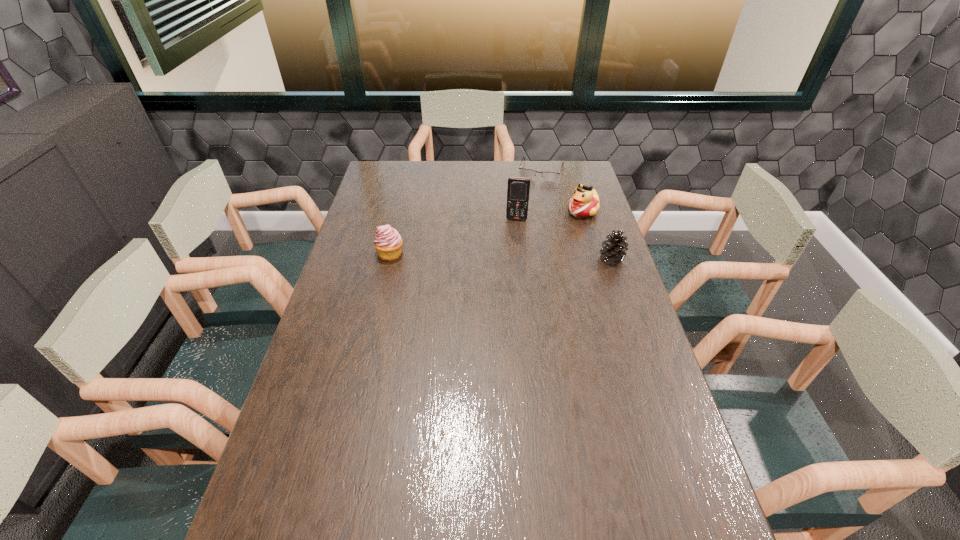
Locate an element on the screen. This screenshot has width=960, height=540. duck positioned at the right edge is located at coordinates (585, 202).

Identify the location of spectacles located in the right edge section of the desktop. (526, 173).

Locate an element on the screen. The height and width of the screenshot is (540, 960). object present at the far right corner is located at coordinates (526, 173).

Locate an element on the screen. vacant area at the far edge is located at coordinates (495, 170).

This screenshot has width=960, height=540. Identify the location of vacant area at the near edge of the desktop. (588, 490).

Where is `vacant space at the right edge of the desktop`? This screenshot has height=540, width=960. vacant space at the right edge of the desktop is located at coordinates (595, 281).

The image size is (960, 540). I want to click on vacant space at the far left corner of the desktop, so click(390, 168).

In the image, there is a desktop. Where is `vacant space at the far right corner`? The image size is (960, 540). vacant space at the far right corner is located at coordinates (567, 162).

The width and height of the screenshot is (960, 540). Find the location of `free spot between the duck and the spectacles`. free spot between the duck and the spectacles is located at coordinates (562, 191).

Locate an element on the screen. The width and height of the screenshot is (960, 540). free space between the duck and the cupcake is located at coordinates (487, 232).